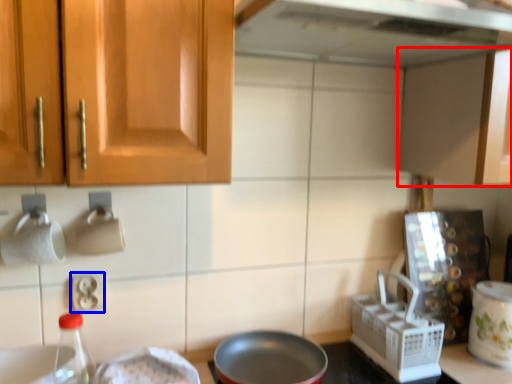
Question: Which of the following is the farthest to the observer, cabinetry (highlighted by a red box) or electric outlet (highlighted by a blue box)?

Choices:
 (A) cabinetry
 (B) electric outlet

Answer: (B)